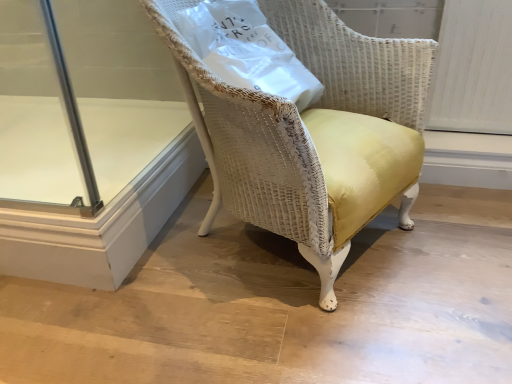
Locate an element on the screen. transparent glass door at lower left is located at coordinates (90, 143).

Where is `white paper bag at upper center`? white paper bag at upper center is located at coordinates pos(247,50).

In order to click on transparent glass door at lower left in this screenshot , I will do [x=90, y=143].

Does point (296, 97) lie in front of point (279, 175)?

No, it is not.

Which object is positioned more to the right, white paper bag at upper center or yellow fabric chair at center?

From the viewer's perspective, yellow fabric chair at center appears more on the right side.

Based on the photo, would you say white paper bag at upper center is a long distance from yellow fabric chair at center?

No, white paper bag at upper center is not far away from yellow fabric chair at center.

Which of these two, white paper bag at upper center or yellow fabric chair at center, is wider?

Wider between the two is yellow fabric chair at center.

Is the surface of white paper bag at upper center in direct contact with transparent glass door at lower left?

No, white paper bag at upper center is not touching transparent glass door at lower left.

Based on the photo, from a real-world perspective, between white paper bag at upper center and transparent glass door at lower left, who is vertically lower?

transparent glass door at lower left, from a real-world perspective.

Is transparent glass door at lower left a part of white paper bag at upper center?

Definitely not — transparent glass door at lower left is not inside white paper bag at upper center.

Could you tell me if white paper bag at upper center is facing transparent glass door at lower left?

No.

Is transparent glass door at lower left wider than yellow fabric chair at center?

Indeed, transparent glass door at lower left has a greater width compared to yellow fabric chair at center.

Considering the positions of objects transparent glass door at lower left and yellow fabric chair at center in the image provided, who is more to the left, transparent glass door at lower left or yellow fabric chair at center?

From the viewer's perspective, transparent glass door at lower left appears more on the left side.

From a real-world perspective, is transparent glass door at lower left above or below yellow fabric chair at center?

In terms of real-world spatial position, transparent glass door at lower left is below yellow fabric chair at center.

From the image's perspective, is transparent glass door at lower left above or below yellow fabric chair at center?

transparent glass door at lower left is below yellow fabric chair at center.

Is yellow fabric chair at center facing away from white paper bag at upper center?

Yes, yellow fabric chair at center is positioned with its back facing white paper bag at upper center.

How different are the orientations of yellow fabric chair at center and white paper bag at upper center in degrees?

yellow fabric chair at center and white paper bag at upper center are facing 11.4 degrees away from each other.

Consider the image. From the image's perspective, does yellow fabric chair at center appear lower than white paper bag at upper center?

Yes.

Between yellow fabric chair at center and white paper bag at upper center, which one has smaller width?

white paper bag at upper center.

Is point (353, 79) closer or farther from the camera than point (145, 96)?

Point (353, 79).

Is yellow fabric chair at center taller than transparent glass door at lower left?

Indeed, yellow fabric chair at center has a greater height compared to transparent glass door at lower left.

In terms of size, does yellow fabric chair at center appear bigger or smaller than transparent glass door at lower left?

yellow fabric chair at center is bigger than transparent glass door at lower left.

Which is in front, point (135, 98) or point (274, 57)?

Positioned in front is point (274, 57).

Would you say transparent glass door at lower left is inside or outside white paper bag at upper center?

transparent glass door at lower left cannot be found inside white paper bag at upper center.

Considering the sizes of objects transparent glass door at lower left and white paper bag at upper center in the image provided, who is wider, transparent glass door at lower left or white paper bag at upper center?

Wider between the two is transparent glass door at lower left.

Considering the relative positions of transparent glass door at lower left and white paper bag at upper center in the image provided, is transparent glass door at lower left to the left or to the right of white paper bag at upper center?

In the image, transparent glass door at lower left appears on the left side of white paper bag at upper center.

Find the location of a particular element. chair on the right of the white paper bag at upper center is located at coordinates click(257, 157).

The width and height of the screenshot is (512, 384). I want to click on glass door below the white paper bag at upper center (from the image's perspective), so click(x=90, y=143).

When comparing their distances from transparent glass door at lower left, does yellow fabric chair at center or white paper bag at upper center seem closer?

Among the two, yellow fabric chair at center is located nearer to transparent glass door at lower left.

Considering their positions, is yellow fabric chair at center positioned further to white paper bag at upper center than transparent glass door at lower left?

transparent glass door at lower left lies further to white paper bag at upper center than the other object.

Which object lies further to the anchor point white paper bag at upper center, transparent glass door at lower left or yellow fabric chair at center?

transparent glass door at lower left.

In the scene shown: Estimate the real-world distances between objects in this image. Which object is further from transparent glass door at lower left, white paper bag at upper center or yellow fabric chair at center?

Based on the image, white paper bag at upper center appears to be further to transparent glass door at lower left.

Which object lies nearer to the anchor point yellow fabric chair at center, white paper bag at upper center or transparent glass door at lower left?

white paper bag at upper center lies closer to yellow fabric chair at center than the other object.

Based on their spatial positions, is transparent glass door at lower left or white paper bag at upper center closer to yellow fabric chair at center?

white paper bag at upper center is positioned closer to the anchor yellow fabric chair at center.

Where is `paper bag situated between transparent glass door at lower left and yellow fabric chair at center from left to right`? This screenshot has height=384, width=512. paper bag situated between transparent glass door at lower left and yellow fabric chair at center from left to right is located at coordinates (247, 50).